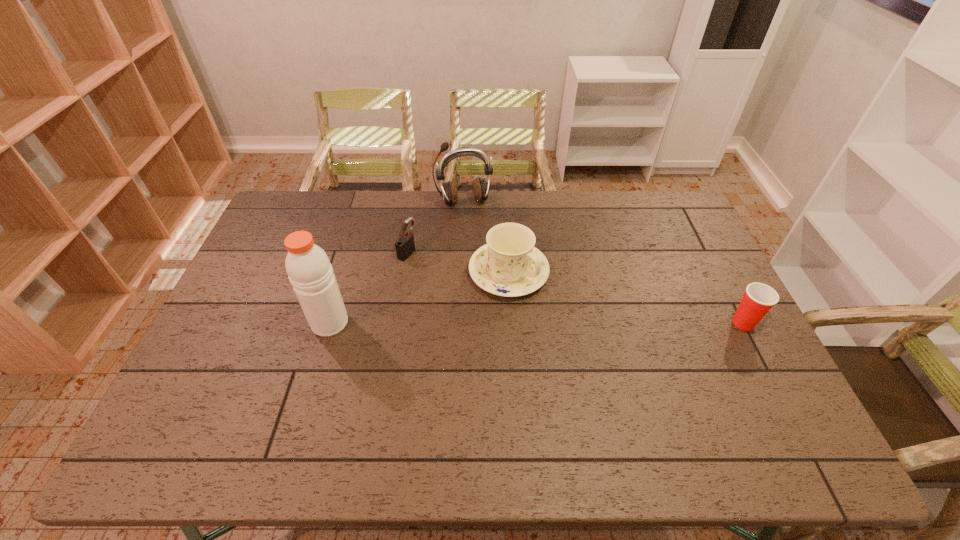
Where is `vacant space that's between the leftmost object and the second object from left to right`? This screenshot has width=960, height=540. vacant space that's between the leftmost object and the second object from left to right is located at coordinates (369, 287).

Image resolution: width=960 pixels, height=540 pixels. What are the coordinates of `free space between the second object from left to right and the Dixie cup` in the screenshot? It's located at (576, 287).

This screenshot has height=540, width=960. Identify the location of unoccupied area between the Dixie cup and the shaker. (537, 323).

The image size is (960, 540). I want to click on empty space that is in between the chinaware and the fourth object from right to left, so click(x=458, y=262).

I want to click on unoccupied area between the chinaware and the padlock, so click(458, 262).

Where is `the closest object relative to the Dixie cup`? the closest object relative to the Dixie cup is located at coordinates (509, 265).

At what (x,y) coordinates should I click in order to perform the action: click on the third closest object to the Dixie cup. Please return your answer as a coordinate pair (x, y). The height and width of the screenshot is (540, 960). Looking at the image, I should click on (405, 246).

I want to click on vacant space that satisfies the following two spatial constraints: 1. on the back side of the chinaware; 2. on the right side of the leftmost object, so pos(345,272).